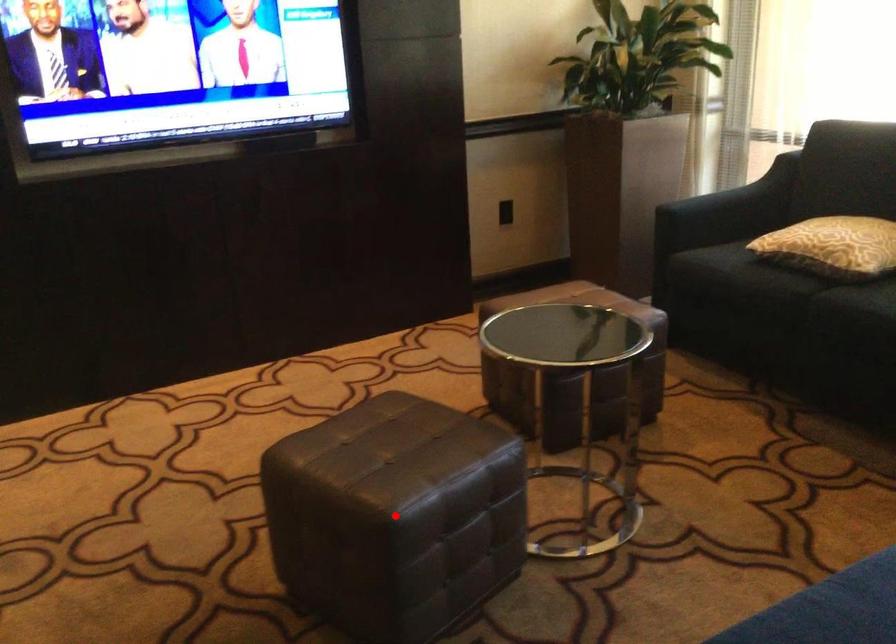
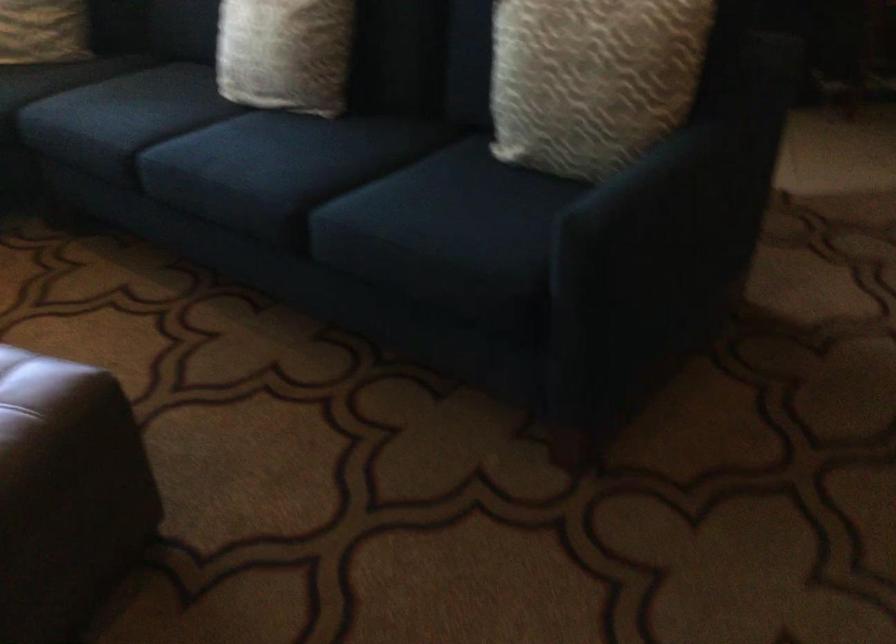
Locate, in the second image, the point that corresponds to the highlighted location in the first image.

(118, 357)